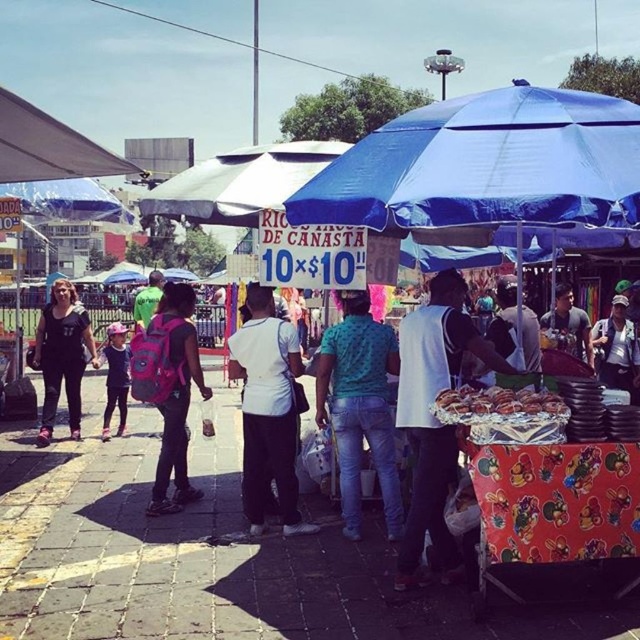
Can you confirm if printed fabric cart at center is bigger than matte gray canopy at upper left?

No, printed fabric cart at center is not bigger than matte gray canopy at upper left.

Describe the element at coordinates (433, 417) in the screenshot. I see `printed fabric cart at center` at that location.

At what (x,y) coordinates should I click in order to perform the action: click on printed fabric cart at center. Please return your answer as a coordinate pair (x, y). Looking at the image, I should click on (433, 417).

Does point (618, 314) come in front of point (504, 404)?

No.

Based on the photo, between camouflage fabric cap at upper right and golden brown bread rolls at center, which one is positioned higher?

camouflage fabric cap at upper right is above.

Identify the location of camouflage fabric cap at upper right. (616, 349).

Does white matte shirt at center have a greater width compared to matte black backpack at left?

No, white matte shirt at center is not wider than matte black backpack at left.

Can you confirm if white matte shirt at center is positioned to the left of matte black backpack at left?

In fact, white matte shirt at center is to the right of matte black backpack at left.

Between point (268, 369) and point (70, 326), which one is positioned in front?

Point (268, 369)

Find the location of `white matte shirt at center`. white matte shirt at center is located at coordinates (268, 410).